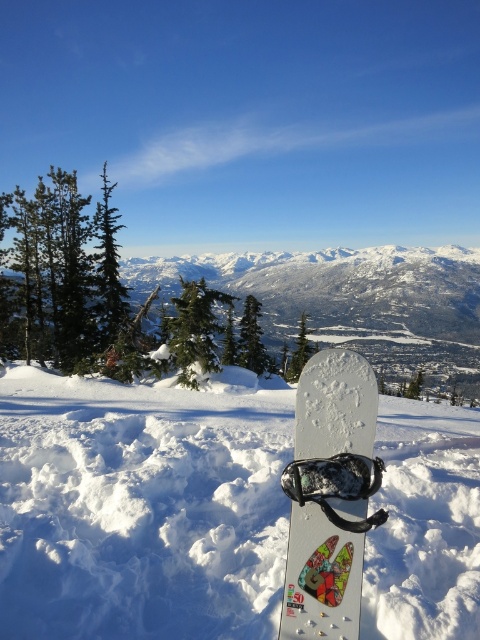
Does point (251, 625) come in front of point (419, 294)?

That is True.

How distant is white matte snowboard at center from snowy white mountain at center?

They are 93.38 meters apart.

Between point (446, 410) and point (136, 275), which one is positioned behind?

Point (136, 275)

The width and height of the screenshot is (480, 640). I want to click on white matte snowboard at center, so tap(141, 508).

Between green matte pine at upper left and white glossy snowboard at center, which one appears on the left side from the viewer's perspective?

white glossy snowboard at center

What do you see at coordinates (100, 294) in the screenshot? Image resolution: width=480 pixels, height=640 pixels. I see `green matte pine at upper left` at bounding box center [100, 294].

Is point (298, 349) behind point (349, 552)?

Yes, point (298, 349) is farther from viewer.

Identify the location of green matte pine at upper left. The height and width of the screenshot is (640, 480). pos(100,294).

Can you confirm if white matte snowboard at center is bigger than white glossy snowboard at center?

Indeed, white matte snowboard at center has a larger size compared to white glossy snowboard at center.

Consider the image. Who is taller, white matte snowboard at center or white glossy snowboard at center?

white glossy snowboard at center

From the picture: Measure the distance between white matte snowboard at center and camera.

They are 3.17 meters apart.

Identify the location of white matte snowboard at center. This screenshot has width=480, height=640. (141, 508).